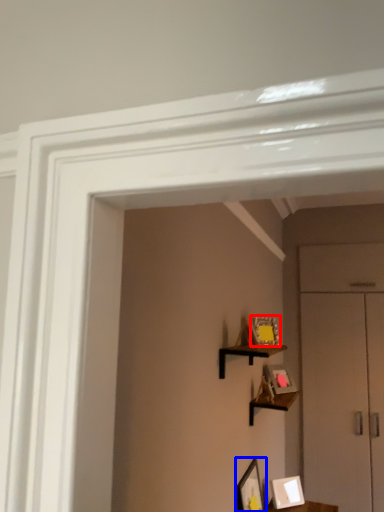
Question: Which object is closer to the camera taking this photo, picture frame (highlighted by a red box) or picture frame (highlighted by a blue box)?

Choices:
 (A) picture frame
 (B) picture frame

Answer: (B)